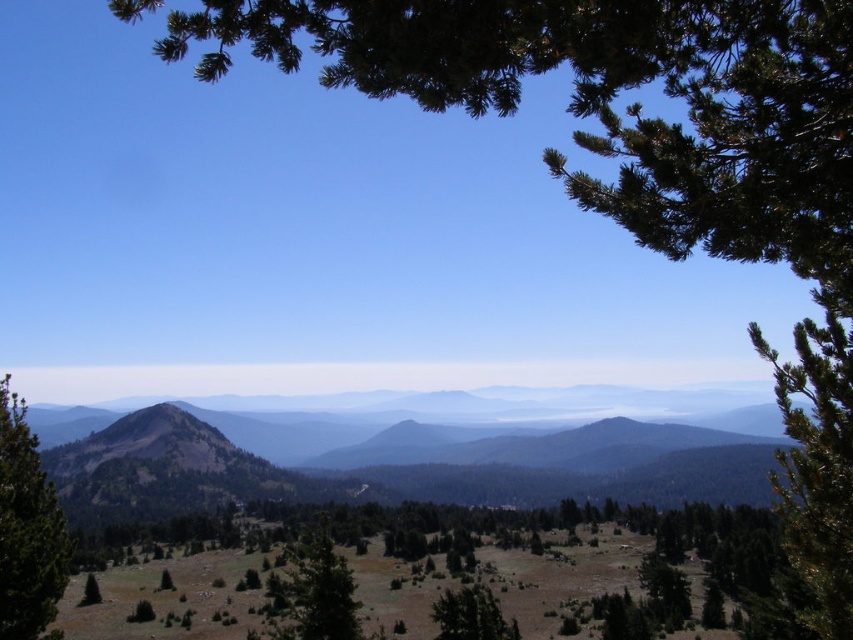
Between green matte tree at lower center and green matte tree at lower left, which one has less height?

With less height is green matte tree at lower left.

Who is more distant from viewer, (476,634) or (90,577)?

Point (90,577)

Locate an element on the screen. green matte tree at lower center is located at coordinates (471, 616).

Which of these two, brown textured mountain at center or green textured tree at left, stands taller?

brown textured mountain at center is taller.

Which is more to the left, brown textured mountain at center or green textured tree at left?

From the viewer's perspective, brown textured mountain at center appears more on the left side.

Does point (625, 481) lie behind point (57, 508)?

Yes, it is.

Find the location of a particular element. The image size is (853, 640). brown textured mountain at center is located at coordinates (401, 460).

Is point (312, 625) less distant than point (469, 632)?

Yes, point (312, 625) is closer to viewer.

Where is `green matte tree at center`? green matte tree at center is located at coordinates (318, 592).